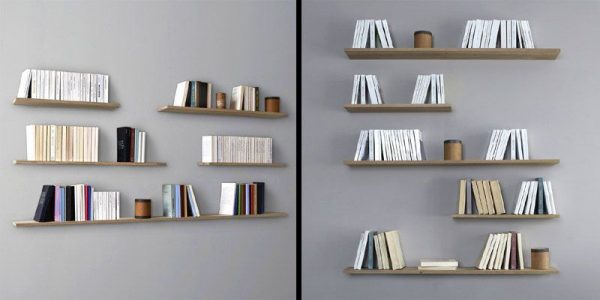
The image size is (600, 300). Find the location of `shelf`. shelf is located at coordinates (235, 114), (87, 101), (91, 162), (96, 222), (236, 165), (444, 165), (406, 103), (417, 52), (456, 271), (487, 215).